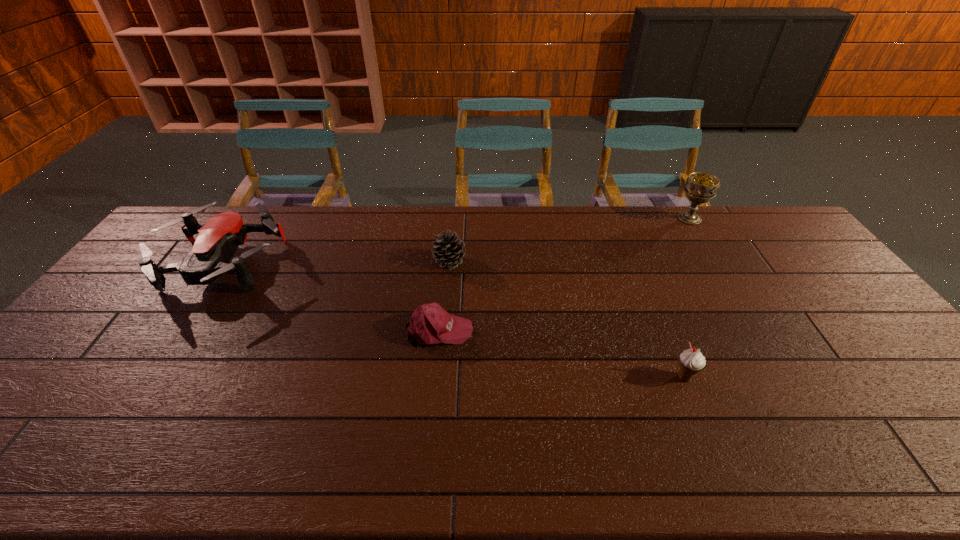
This screenshot has height=540, width=960. In order to click on free location that satisfies the following two spatial constraints: 1. on the back side of the pinecone; 2. on the right side of the chalice in this screenshot , I will do `click(453, 219)`.

Identify the location of vacant space that satisfies the following two spatial constraints: 1. on the camera side of the fourth object from left to right; 2. on the right side of the drone. Image resolution: width=960 pixels, height=540 pixels. (150, 377).

Locate an element on the screen. The width and height of the screenshot is (960, 540). vacant area in the image that satisfies the following two spatial constraints: 1. at the front of the shortest object with the brim; 2. on the back side of the icecream is located at coordinates click(435, 377).